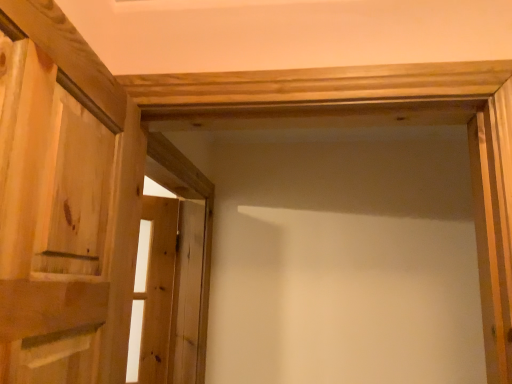
What is the approximate height of natural wood screen door at center?

natural wood screen door at center is 32.55 inches in height.

What is the approximate width of natural wood screen door at center?

1.15 inches.

What do you see at coordinates (173, 270) in the screenshot? I see `natural wood screen door at center` at bounding box center [173, 270].

Image resolution: width=512 pixels, height=384 pixels. What are the coordinates of `natural wood screen door at center` in the screenshot? It's located at (173, 270).

Identify the location of natural wood screen door at center. (173, 270).